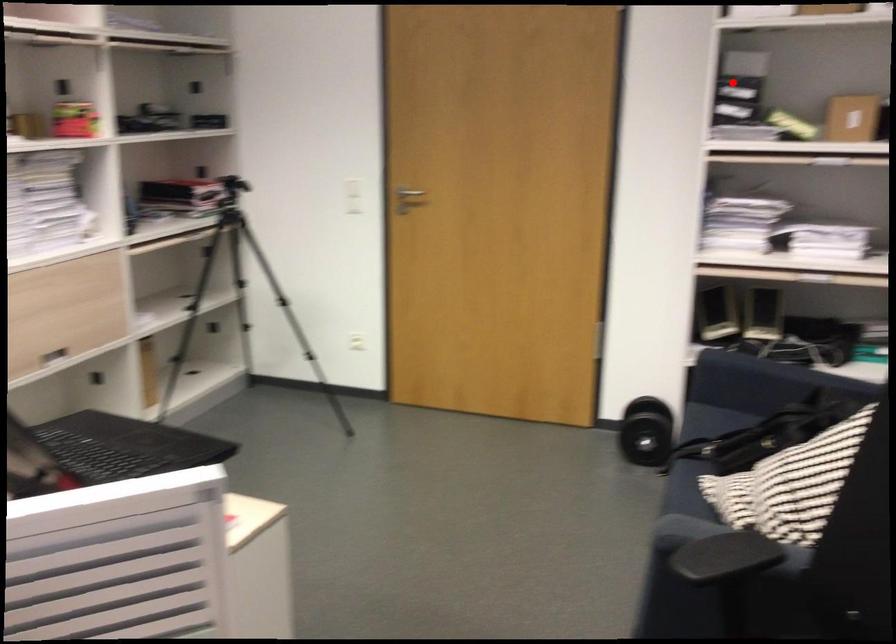
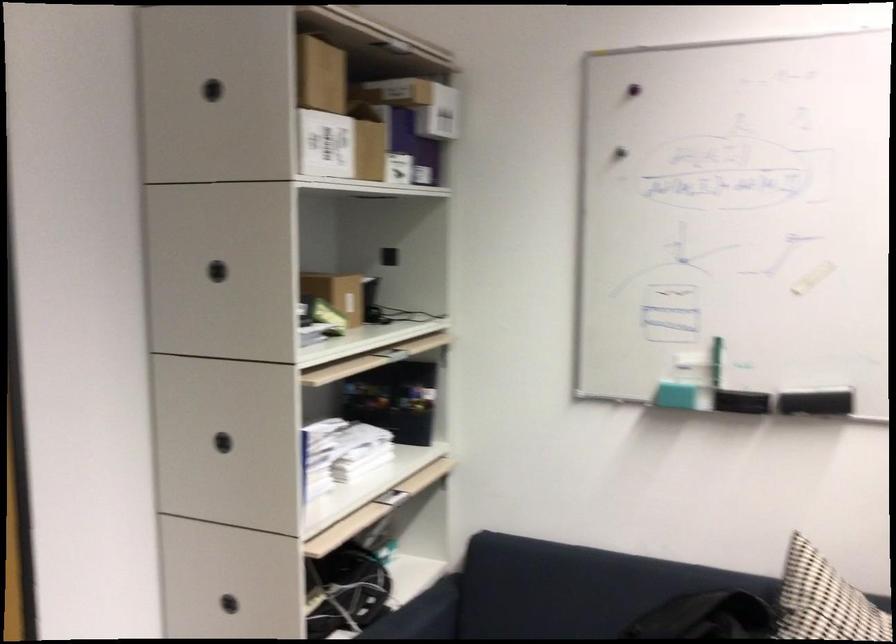
Question: I am providing you with two images of the same scene from different viewpoints. In image1, a red point is highlighted. Considering the same 3D point in image2, which of the following is correct?

Choices:
 (A) It is closer
 (B) It is farther

Answer: (A)